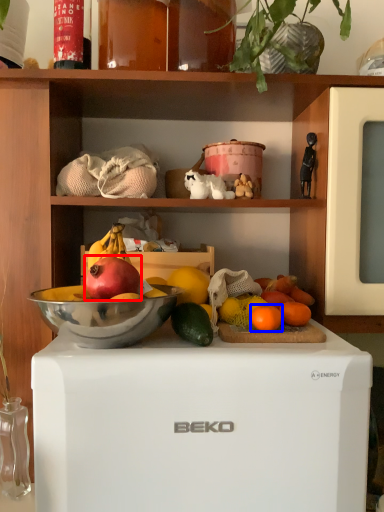
Question: Which object appears farthest to the camera in this image, grapefruit (highlighted by a red box) or grapefruit (highlighted by a blue box)?

Choices:
 (A) grapefruit
 (B) grapefruit

Answer: (B)